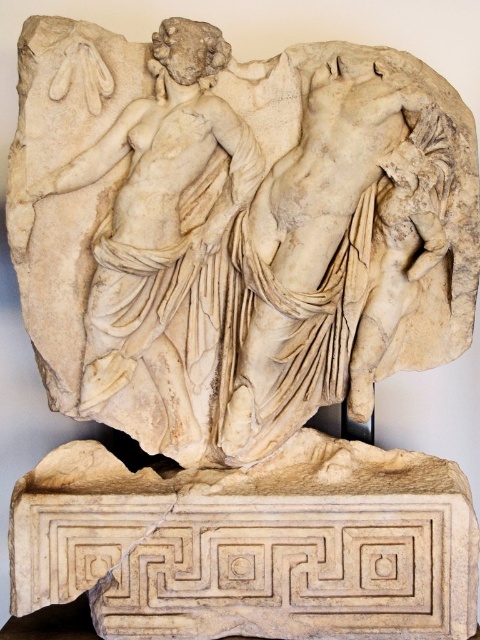
Question: Which of the following is the farthest from the observer?

Choices:
 (A) tap(139, 333)
 (B) tap(332, 144)

Answer: (A)

Question: Can you confirm if white marble sculpture at center is wider than white marble statue at left?

Choices:
 (A) no
 (B) yes

Answer: (B)

Question: Does white marble sculpture at center appear on the right side of white marble torso at center?

Choices:
 (A) no
 (B) yes

Answer: (A)

Question: Where is white marble sculpture at center located in relation to white marble torso at center in the image?

Choices:
 (A) right
 (B) left

Answer: (B)

Question: Which point appears closest to the camera in this image?

Choices:
 (A) coord(384,74)
 (B) coord(352,129)

Answer: (B)

Question: Which object is positioned closest to the white marble torso at center?

Choices:
 (A) white marble statue at left
 (B) white marble sculpture at center

Answer: (B)